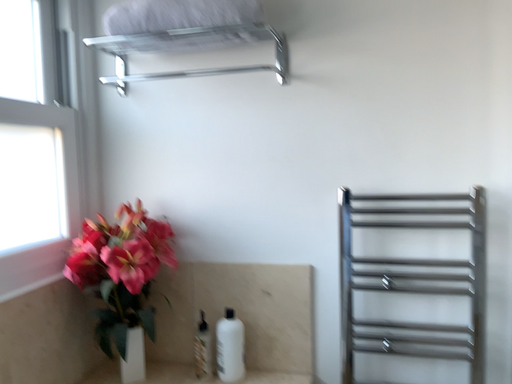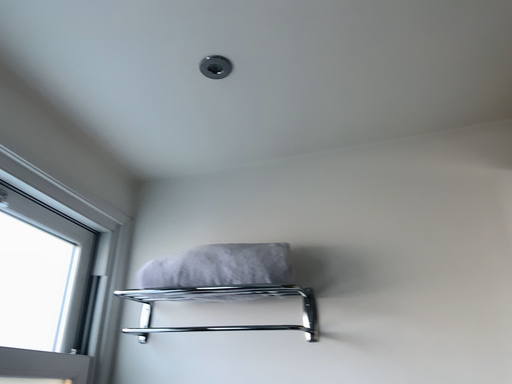
Question: Which way did the camera rotate in the video?

Choices:
 (A) rotated downward
 (B) rotated upward

Answer: (B)